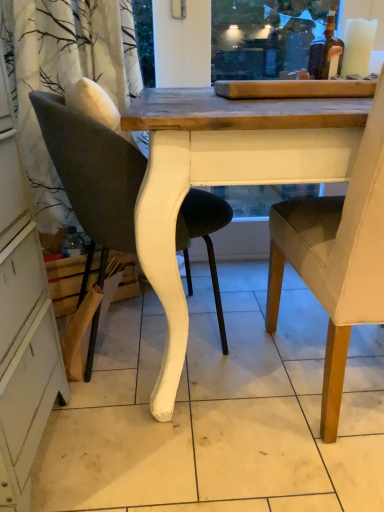
Image resolution: width=384 pixels, height=512 pixels. In order to click on vacant region under white painted wood chair at left, which is the 1th chair in left-to-right order (from a real-world perspective) in this screenshot , I will do `click(155, 344)`.